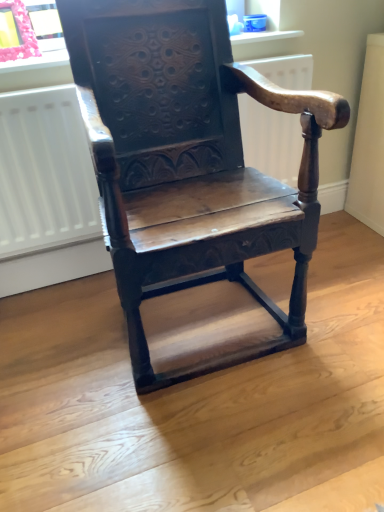
I want to click on pink fabric at upper left, so click(x=27, y=31).

The image size is (384, 512). I want to click on white matte radiator at center, so click(x=44, y=173).

From the image's perspective, is matte plastic window sill at upper center located above white matte radiator at center?

Indeed, from the image's perspective, matte plastic window sill at upper center is shown above white matte radiator at center.

Could you tell me if matte plastic window sill at upper center is facing white matte radiator at center?

No.

Identify the location of radiator below the matte plastic window sill at upper center (from a real-world perspective). The height and width of the screenshot is (512, 384). (44, 173).

Can you tell me how much matte plastic window sill at upper center and white matte radiator at center differ in facing direction?

The angular difference between matte plastic window sill at upper center and white matte radiator at center is 0.394 degrees.

From a real-world perspective, is wooden carved chair at center on top of pink fabric at upper left?

No.

Is point (283, 185) closer or farther from the camera than point (9, 53)?

Point (283, 185) appears to be farther away from the viewer than point (9, 53).

Would you say pink fabric at upper left is part of wooden carved chair at center's contents?

No, pink fabric at upper left is not inside wooden carved chair at center.

Is wooden carved chair at center not near pink fabric at upper left?

No, there isn't a large distance between wooden carved chair at center and pink fabric at upper left.

You are a GUI agent. You are given a task and a screenshot of the screen. Output one action in this format:
    pyautogui.click(x=<x>, y=<y>)
    Task: Click on the window sill on the right side of pink fabric at upper left
    
    Given the screenshot: What is the action you would take?
    pyautogui.click(x=36, y=72)

Can you confirm if pink fabric at upper left is taller than matte plastic window sill at upper center?

Yes, pink fabric at upper left is taller than matte plastic window sill at upper center.

Is pink fabric at upper left bigger or smaller than matte plastic window sill at upper center?

Considering their sizes, pink fabric at upper left takes up less space than matte plastic window sill at upper center.

Considering the relative sizes of matte plastic window sill at upper center and wooden carved chair at center in the image provided, is matte plastic window sill at upper center wider than wooden carved chair at center?

No, matte plastic window sill at upper center is not wider than wooden carved chair at center.

Consider the image. Is matte plastic window sill at upper center positioned far away from wooden carved chair at center?

No, there isn't a large distance between matte plastic window sill at upper center and wooden carved chair at center.

From the image's perspective, which object appears higher, matte plastic window sill at upper center or wooden carved chair at center?

matte plastic window sill at upper center appears higher in the image.

Is white matte radiator at center thinner than matte plastic window sill at upper center?

Yes.

From a real-world perspective, is white matte radiator at center physically located above or below matte plastic window sill at upper center?

white matte radiator at center is below matte plastic window sill at upper center.

Is white matte radiator at center taller or shorter than matte plastic window sill at upper center?

white matte radiator at center is taller than matte plastic window sill at upper center.

Would you say white matte radiator at center contains matte plastic window sill at upper center?

No, white matte radiator at center does not contain matte plastic window sill at upper center.

Consider the image. Is pink fabric at upper left not inside white matte radiator at center?

Yes, pink fabric at upper left is located beyond the bounds of white matte radiator at center.

Consider the image. Between pink fabric at upper left and white matte radiator at center, which one appears on the right side from the viewer's perspective?

From the viewer's perspective, white matte radiator at center appears more on the right side.

Is pink fabric at upper left taller or shorter than white matte radiator at center?

In the image, pink fabric at upper left appears to be shorter than white matte radiator at center.

From a real-world perspective, which is physically below, pink fabric at upper left or white matte radiator at center?

white matte radiator at center.

From the image's perspective, which one is positioned lower, wooden carved chair at center or white matte radiator at center?

From the image's view, wooden carved chair at center is below.

Locate an element on the screen. The width and height of the screenshot is (384, 512). radiator that appears behind the wooden carved chair at center is located at coordinates (44, 173).

In the scene shown: Is wooden carved chair at center bigger than white matte radiator at center?

Correct, wooden carved chair at center is larger in size than white matte radiator at center.

Can we say wooden carved chair at center lies outside white matte radiator at center?

Yes, wooden carved chair at center is located beyond the bounds of white matte radiator at center.

Identify the location of radiator in front of the matte plastic window sill at upper center. The image size is (384, 512). (44, 173).

Image resolution: width=384 pixels, height=512 pixels. I want to click on chair on the right of pink fabric at upper left, so click(188, 161).

When comparing their distances from matte plastic window sill at upper center, does wooden carved chair at center or pink fabric at upper left seem closer?

The object closer to matte plastic window sill at upper center is pink fabric at upper left.

Which object lies further to the anchor point pink fabric at upper left, white matte radiator at center or matte plastic window sill at upper center?

white matte radiator at center.

Looking at the image, which one is located further to wooden carved chair at center, matte plastic window sill at upper center or white matte radiator at center?

matte plastic window sill at upper center is positioned further to the anchor wooden carved chair at center.

Estimate the real-world distances between objects in this image. Which object is further from white matte radiator at center, matte plastic window sill at upper center or wooden carved chair at center?

wooden carved chair at center is positioned further to the anchor white matte radiator at center.

When comparing their distances from pink fabric at upper left, does matte plastic window sill at upper center or wooden carved chair at center seem further?

wooden carved chair at center lies further to pink fabric at upper left than the other object.

Based on their spatial positions, is pink fabric at upper left or wooden carved chair at center further from white matte radiator at center?

wooden carved chair at center lies further to white matte radiator at center than the other object.

Considering their positions, is pink fabric at upper left positioned further to matte plastic window sill at upper center than white matte radiator at center?

The object further to matte plastic window sill at upper center is white matte radiator at center.

When comparing their distances from white matte radiator at center, does pink fabric at upper left or matte plastic window sill at upper center seem further?

Based on the image, pink fabric at upper left appears to be further to white matte radiator at center.

Identify the location of window frame between wooden carved chair at center and matte plastic window sill at upper center in the front-back direction. This screenshot has width=384, height=512. (27, 31).

The width and height of the screenshot is (384, 512). Identify the location of radiator positioned between wooden carved chair at center and matte plastic window sill at upper center from near to far. (44, 173).

You are a GUI agent. You are given a task and a screenshot of the screen. Output one action in this format:
    pyautogui.click(x=<x>, y=<y>)
    Task: Click on the window frame between matte plastic window sill at upper center and white matte radiator at center vertically
    The image size is (384, 512).
    Given the screenshot: What is the action you would take?
    pyautogui.click(x=27, y=31)

The height and width of the screenshot is (512, 384). Find the location of `radiator located between wooden carved chair at center and pink fabric at upper left in the depth direction`. radiator located between wooden carved chair at center and pink fabric at upper left in the depth direction is located at coordinates (44, 173).